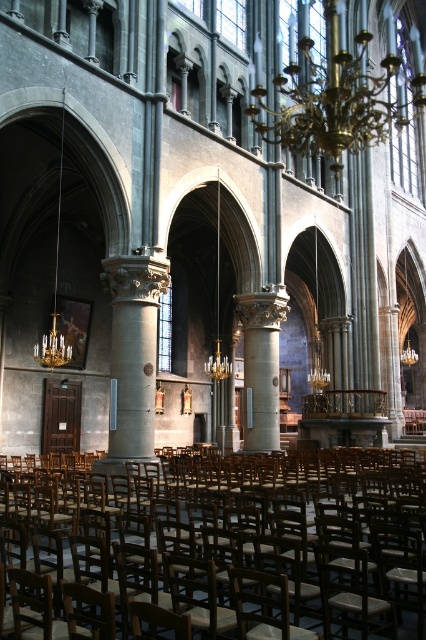
You are standing at point [195,547] in the cathedral. What object can you see directly in front of you?

At point [195,547] lies wooden chair at center.

You are standing at the entrance of the cathedral and want to sit in the wooden chair at center. Which direction should you walk to reach it?

The wooden chair at center is located at point 0.856 along the horizontal axis and 0.458 along the vertical axis. Since you are at the entrance, which is typically at the front of the cathedral, you should walk forward towards the altar area to reach the wooden chair at center.

You are an interior designer assessing the cathedral space. You need to determine if the wooden chair at center can be placed under the gold metallic chandelier at upper center without blocking the light. Based on their sizes, is this feasible?

The wooden chair at center is smaller than the gold metallic chandelier at upper center, so placing it underneath would likely not block the light significantly, as the chair takes up less space vertically and horizontally.